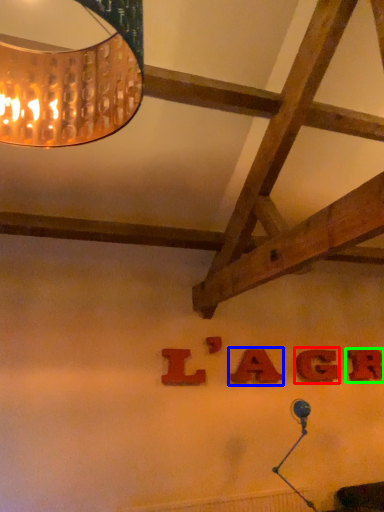
Question: Based on their relative distances, which object is nearer to letter (highlighted by a red box)? Choose from letter (highlighted by a blue box) and letter (highlighted by a green box).

Choices:
 (A) letter
 (B) letter

Answer: (B)